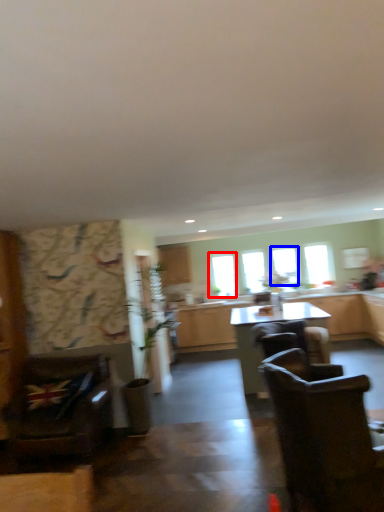
Question: Which object appears farthest to the camera in this image, window (highlighted by a red box) or window (highlighted by a blue box)?

Choices:
 (A) window
 (B) window

Answer: (A)